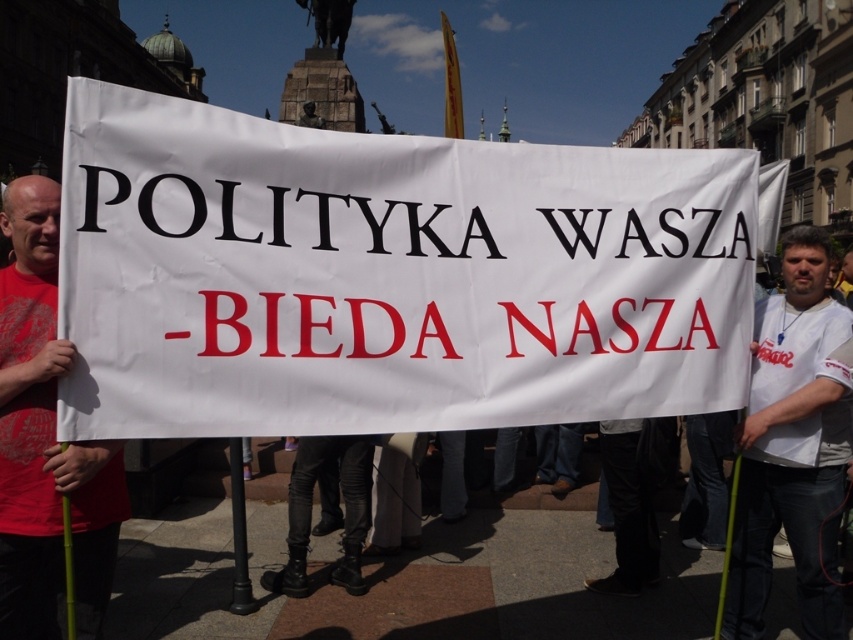
Question: Is white paper banner at center below red t-shirt at left?

Choices:
 (A) yes
 (B) no

Answer: (B)

Question: Among these objects, which one is farthest from the camera?

Choices:
 (A) white paper banner at center
 (B) white cotton t-shirt at center

Answer: (B)

Question: Which object is closer to the camera taking this photo?

Choices:
 (A) white paper banner at center
 (B) red t-shirt at left
 (C) white cotton t-shirt at center

Answer: (A)

Question: Which point is closer to the camera?

Choices:
 (A) white paper banner at center
 (B) white cotton t-shirt at center
 (C) red t-shirt at left

Answer: (A)

Question: Does white paper banner at center appear over white cotton t-shirt at center?

Choices:
 (A) yes
 (B) no

Answer: (A)

Question: From the image, what is the correct spatial relationship of white paper banner at center in relation to white cotton t-shirt at center?

Choices:
 (A) left
 (B) right

Answer: (A)